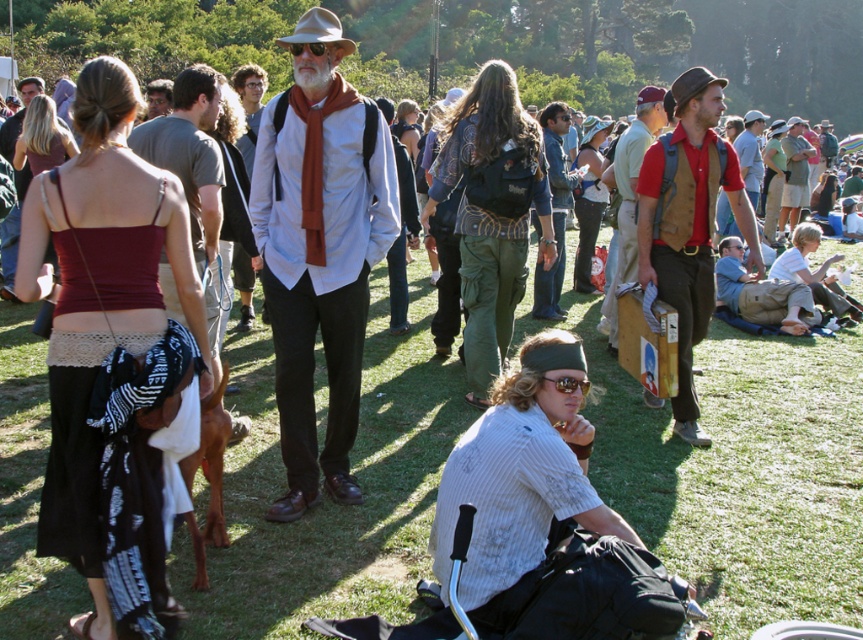
Question: Which of the following is the closest to the observer?

Choices:
 (A) matte red tank top at left
 (B) khaki pants at lower right

Answer: (A)

Question: Which of the following is the closest to the observer?

Choices:
 (A) (632, 134)
 (B) (665, 262)

Answer: (B)

Question: Which point is farther to the camera?

Choices:
 (A) matte khaki pants at center
 (B) matte white shirt at center
 (C) red cotton shirt at center

Answer: (A)

Question: Is green grass at center bigger than red cotton shirt at center?

Choices:
 (A) no
 (B) yes

Answer: (A)

Question: Can you confirm if textured olive green pants at center is positioned above matte khaki pants at center?

Choices:
 (A) no
 (B) yes

Answer: (A)

Question: Does khaki cotton shirt at center appear on the left side of matte brown hat at center?

Choices:
 (A) yes
 (B) no

Answer: (B)